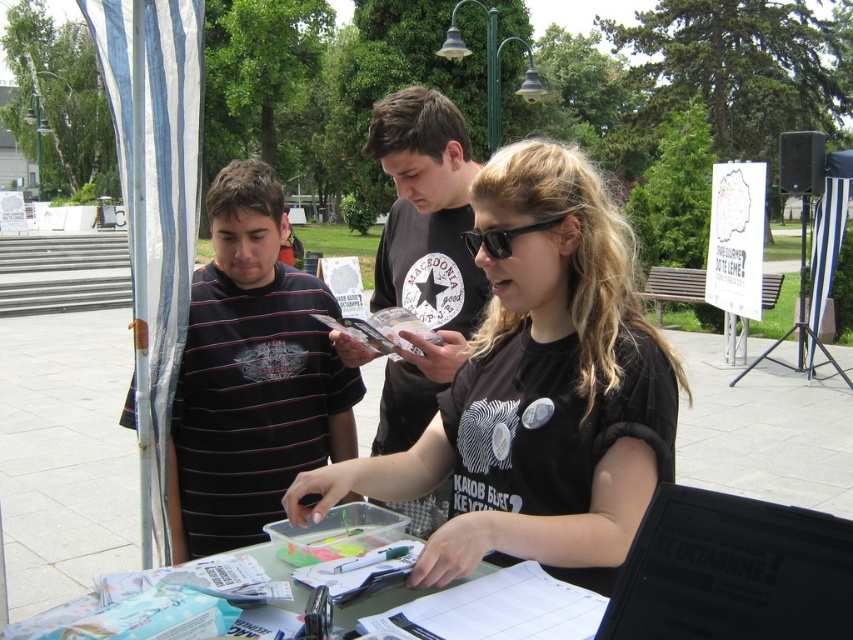
Consider the image. Can you confirm if black cotton shirt at center is thinner than black plastic sunglasses at center?

Incorrect, black cotton shirt at center's width is not less than black plastic sunglasses at center's.

Which is below, black cotton shirt at center or black plastic sunglasses at center?

black cotton shirt at center is lower down.

You are a GUI agent. You are given a task and a screenshot of the screen. Output one action in this format:
    pyautogui.click(x=<x>, y=<y>)
    Task: Click on the black cotton shirt at center
    
    Given the screenshot: What is the action you would take?
    pyautogui.click(x=422, y=253)

I want to click on black cotton shirt at center, so click(x=422, y=253).

Is point (265, 230) positioned in front of point (466, 243)?

No, it is behind (466, 243).

Is black striped shirt at left to the left of black plastic sunglasses at center from the viewer's perspective?

Correct, you'll find black striped shirt at left to the left of black plastic sunglasses at center.

Is point (291, 403) farther from camera compared to point (471, 228)?

That is True.

Find the location of a particular element. This screenshot has height=640, width=853. black striped shirt at left is located at coordinates (251, 376).

Does black matte t-shirt at center have a smaller size compared to black striped shirt at left?

Indeed, black matte t-shirt at center has a smaller size compared to black striped shirt at left.

In the scene shown: Does black matte t-shirt at center lie in front of black striped shirt at left?

Yes.

Does point (595, 316) lie behind point (233, 508)?

No, it is in front of (233, 508).

Image resolution: width=853 pixels, height=640 pixels. What are the coordinates of `black matte t-shirt at center` in the screenshot? It's located at [x=538, y=394].